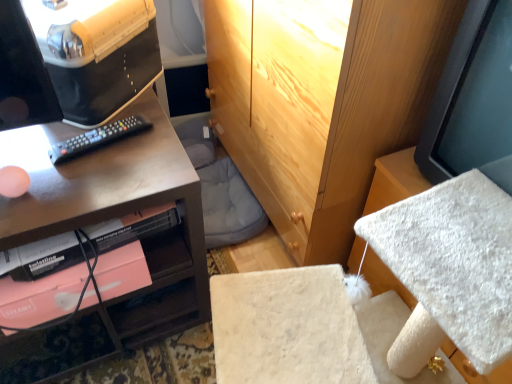
In order to click on free location to the right of black plastic remote at left in this screenshot , I will do `click(154, 156)`.